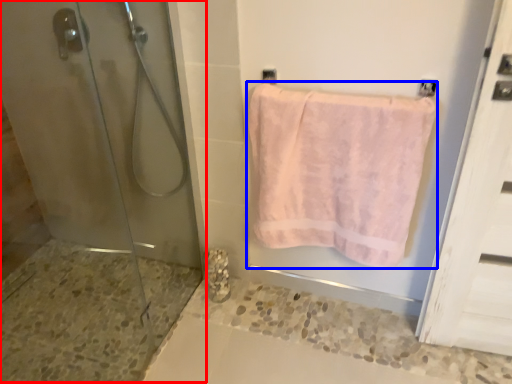
Question: Which point is further to the camera, shower door (highlighted by a red box) or towel (highlighted by a blue box)?

Choices:
 (A) shower door
 (B) towel

Answer: (B)